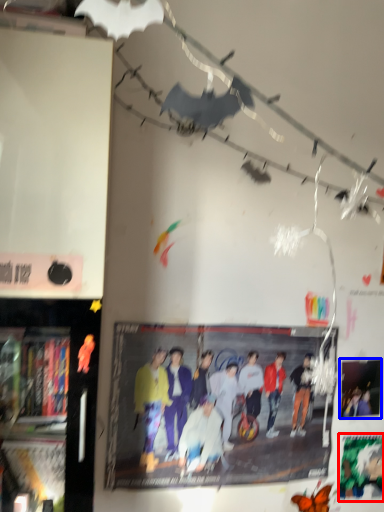
Question: Which object appears closest to the camera in this image, poster page (highlighted by a red box) or poster page (highlighted by a blue box)?

Choices:
 (A) poster page
 (B) poster page

Answer: (B)